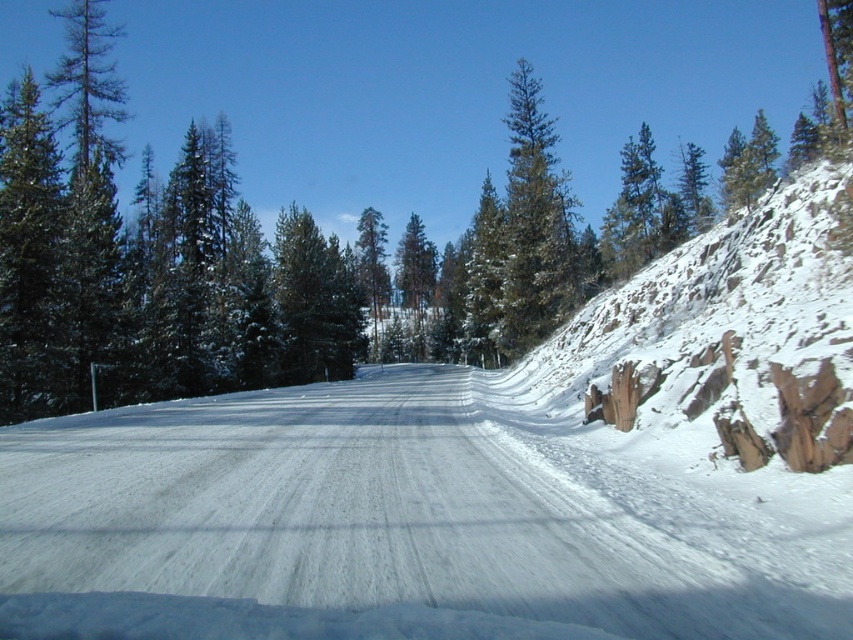
Is point (583, 486) positioned in front of point (96, 28)?

Yes, point (583, 486) is closer to viewer.

Can you confirm if white snow-covered road at center is wider than green textured pine at center?

Incorrect, white snow-covered road at center's width does not surpass green textured pine at center's.

Which is behind, point (241, 472) or point (590, 227)?

Positioned behind is point (590, 227).

Image resolution: width=853 pixels, height=640 pixels. Find the location of `white snow-covered road at center`. white snow-covered road at center is located at coordinates (418, 518).

Between green textured pine at center and green textured pine tree at center, which one has more height?

green textured pine at center

Find the location of `green textured pine at center`. green textured pine at center is located at coordinates (277, 252).

What are the coordinates of `green textured pine at center` in the screenshot? It's located at (277, 252).

Which is in front, point (401, 608) or point (509, 257)?

Positioned in front is point (401, 608).

Is white snow-covered road at center behind green textured pine tree at center?

That is False.

Between point (769, 506) and point (556, 180), which one is positioned behind?

The point (556, 180) is behind.

The width and height of the screenshot is (853, 640). I want to click on white snow-covered road at center, so click(418, 518).